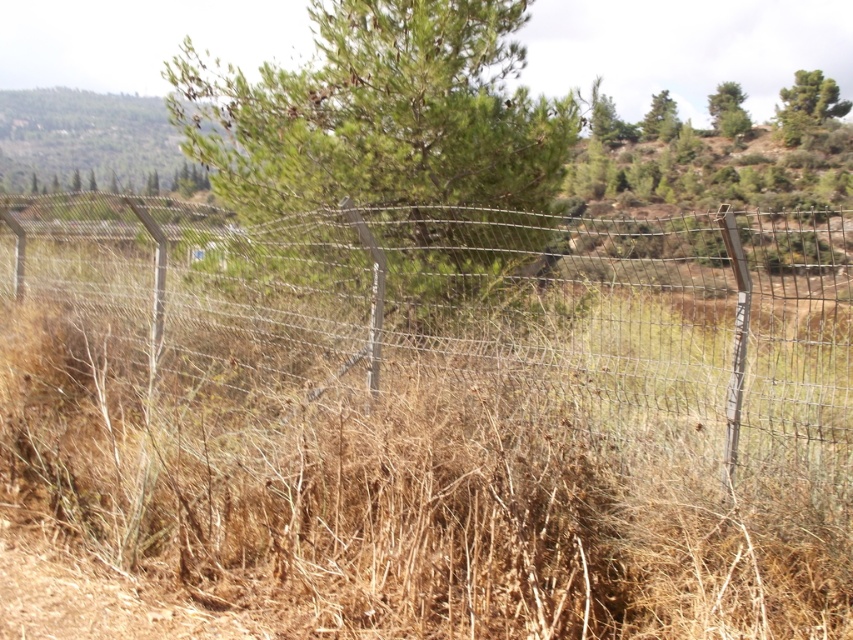
You are a hiker who wants to take a photo of the green textured tree at upper right from the front side of the wire mesh fence at center. Based on their heights, will you need to crouch down or stand up straight to frame the tree properly?

The wire mesh fence at center is shorter than the green textured tree at upper right, so you can stand up straight to frame the tree properly without needing to crouch down.